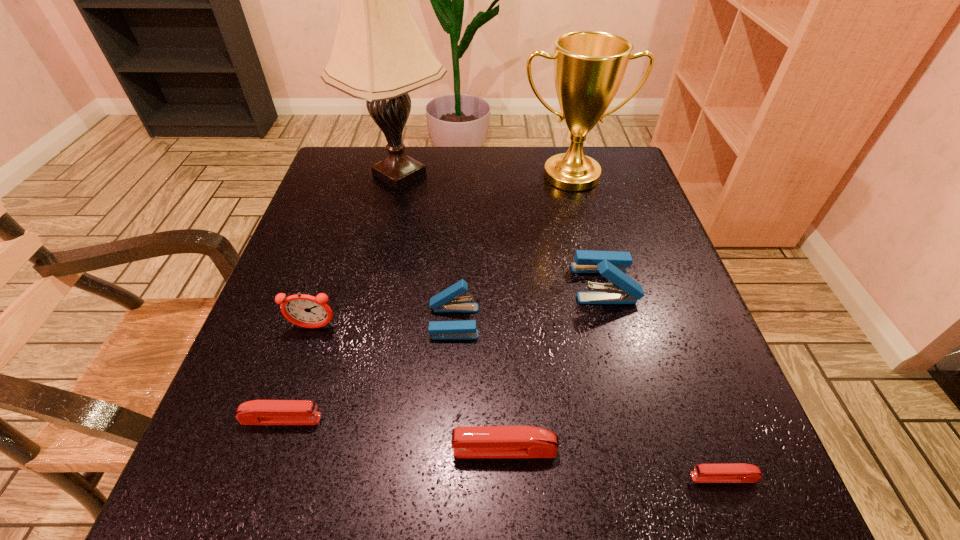
The width and height of the screenshot is (960, 540). In order to click on the tallest object in this screenshot , I will do `click(379, 54)`.

The image size is (960, 540). I want to click on beige lamp, so click(x=379, y=54).

This screenshot has height=540, width=960. What are the coordinates of `the second tallest object` in the screenshot? It's located at (589, 66).

The width and height of the screenshot is (960, 540). What are the coordinates of `gold award` in the screenshot? It's located at (589, 66).

Where is `the farther blue stapler`? This screenshot has width=960, height=540. the farther blue stapler is located at coordinates (612, 265).

You are a GUI agent. You are given a task and a screenshot of the screen. Output one action in this format:
    pyautogui.click(x=<x>, y=<y>)
    Task: Click on the tallest stapler
    The image size is (960, 540).
    Given the screenshot: What is the action you would take?
    pyautogui.click(x=612, y=265)

Locate an element on the screen. reddish-pink alarm clock is located at coordinates (303, 310).

Where is `the smaller blue stapler`? Image resolution: width=960 pixels, height=540 pixels. the smaller blue stapler is located at coordinates (446, 301).

Find the location of a particular element. The height and width of the screenshot is (540, 960). the nearer blue stapler is located at coordinates (446, 301).

Find the location of a particular element. The image size is (960, 540). the biggest red stapler is located at coordinates (468, 441).